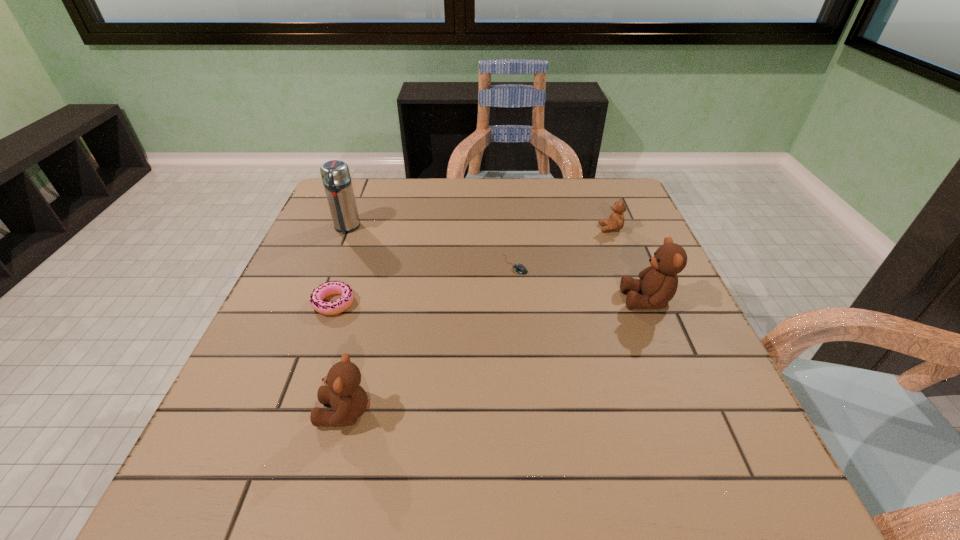
The image size is (960, 540). What are the coordinates of `vacant position for inserting another teddy_bear evenly` in the screenshot? It's located at (515, 349).